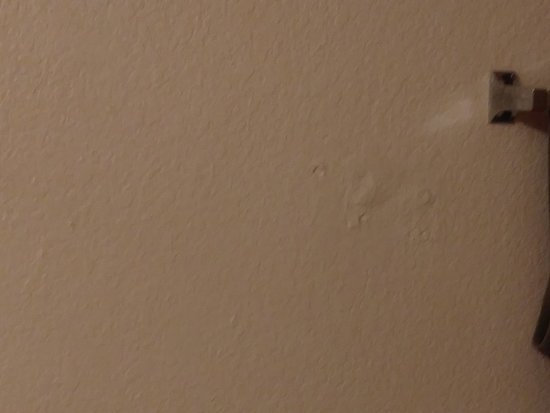
Find the where you'd mount the towel rank in the image. Your answer should be formatted as a list of tuples, i.e. [(x1, y1), (x2, y2), ...], where each tuple contains the x and y coordinates of a point satisfying the conditions above.

[(500, 78)]